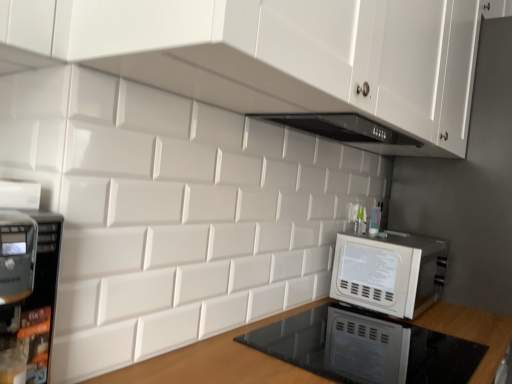
Consider the image. In order to face white glossy microwave at right, should I rotate leftwards or rightwards?

To face it directly, rotate right by 17.928 degrees.

What do you see at coordinates (216, 362) in the screenshot? I see `wooden at lower center` at bounding box center [216, 362].

At what (x,y) coordinates should I click in order to perform the action: click on white glossy cabinet at upper center. Please return your answer as a coordinate pair (x, y). Looking at the image, I should click on (275, 54).

Where is `white glossy microwave at right`? white glossy microwave at right is located at coordinates (389, 272).

Could you tell me if white glossy cabinet at upper center is facing wooden at lower center?

No, white glossy cabinet at upper center is not turned towards wooden at lower center.

Is white glossy cabinet at upper center inside or outside of wooden at lower center?

white glossy cabinet at upper center is outside wooden at lower center.

Are white glossy cabinet at upper center and wooden at lower center making contact?

No, white glossy cabinet at upper center is not beside wooden at lower center.

In the image, is wooden at lower center positioned in front of or behind white glossy cabinet at upper center?

wooden at lower center is in front of white glossy cabinet at upper center.

Is wooden at lower center taller or shorter than white glossy cabinet at upper center?

Clearly, wooden at lower center is shorter compared to white glossy cabinet at upper center.

In terms of width, does wooden at lower center look wider or thinner when compared to white glossy cabinet at upper center?

In the image, wooden at lower center appears to be wider than white glossy cabinet at upper center.

Does wooden at lower center have a smaller size compared to white glossy cabinet at upper center?

Actually, wooden at lower center might be larger than white glossy cabinet at upper center.

Does white glossy microwave at right turn towards wooden at lower center?

No, white glossy microwave at right is not facing towards wooden at lower center.

From the image's perspective, relative to wooden at lower center, is white glossy microwave at right above or below?

Clearly, from the image's perspective, white glossy microwave at right is above wooden at lower center.

Considering the positions of objects white glossy microwave at right and wooden at lower center in the image provided, who is more to the right, white glossy microwave at right or wooden at lower center?

Positioned to the right is white glossy microwave at right.

Between wooden at lower center and white glossy microwave at right, which one appears on the right side from the viewer's perspective?

white glossy microwave at right is more to the right.

From the image's perspective, which one is positioned higher, wooden at lower center or white glossy microwave at right?

From the image's view, white glossy microwave at right is above.

Which point is more forward, (497, 359) or (385, 290)?

The point (497, 359) is more forward.

Identify the location of cabinetry in front of the white glossy microwave at right. (275, 54).

Measure the distance from white glossy cabinet at upper center to white glossy microwave at right.

25.87 inches.

Considering the sizes of objects white glossy cabinet at upper center and white glossy microwave at right in the image provided, who is thinner, white glossy cabinet at upper center or white glossy microwave at right?

white glossy microwave at right is thinner.

Does white glossy cabinet at upper center have a lesser height compared to white glossy microwave at right?

No.

Considering the relative positions of white glossy microwave at right and white glossy cabinet at upper center in the image provided, is white glossy microwave at right behind white glossy cabinet at upper center?

Yes, white glossy microwave at right is behind white glossy cabinet at upper center.

Choose the correct answer: Is white glossy microwave at right inside white glossy cabinet at upper center or outside it?

white glossy microwave at right is outside white glossy cabinet at upper center.

Who is shorter, white glossy microwave at right or white glossy cabinet at upper center?

With less height is white glossy microwave at right.

Who is bigger, white glossy microwave at right or white glossy cabinet at upper center?

white glossy cabinet at upper center.

Locate an element on the screen. The height and width of the screenshot is (384, 512). countertop below the white glossy cabinet at upper center (from a real-world perspective) is located at coordinates (216, 362).

The width and height of the screenshot is (512, 384). I want to click on countertop on the left of white glossy cabinet at upper center, so click(x=216, y=362).

When comparing their distances from white glossy microwave at right, does white glossy cabinet at upper center or wooden at lower center seem closer?

Among the two, wooden at lower center is located nearer to white glossy microwave at right.

From the image, which object appears to be farther from wooden at lower center, white glossy cabinet at upper center or white glossy microwave at right?

Based on the image, white glossy cabinet at upper center appears to be further to wooden at lower center.

Consider the image. Based on their spatial positions, is white glossy microwave at right or white glossy cabinet at upper center closer to wooden at lower center?

white glossy microwave at right lies closer to wooden at lower center than the other object.

Estimate the real-world distances between objects in this image. Which object is closer to white glossy microwave at right, wooden at lower center or white glossy cabinet at upper center?

Based on the image, wooden at lower center appears to be nearer to white glossy microwave at right.

From the image, which object appears to be nearer to white glossy cabinet at upper center, white glossy microwave at right or wooden at lower center?

white glossy microwave at right lies closer to white glossy cabinet at upper center than the other object.

Looking at the image, which one is located further to white glossy cabinet at upper center, wooden at lower center or white glossy microwave at right?

wooden at lower center is further to white glossy cabinet at upper center.

You are a GUI agent. You are given a task and a screenshot of the screen. Output one action in this format:
    pyautogui.click(x=<x>, y=<y>)
    Task: Click on the home appliance between white glossy cabinet at upper center and wooden at lower center in the up-down direction
    The image size is (512, 384).
    Given the screenshot: What is the action you would take?
    pyautogui.click(x=389, y=272)